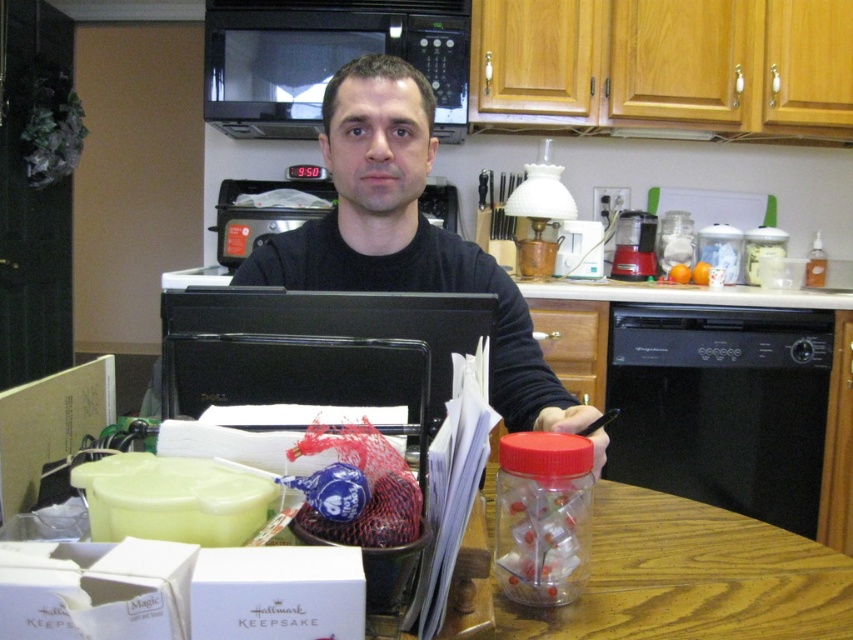
Question: Among these points, which one is nearest to the camera?

Choices:
 (A) (509, 586)
 (B) (817, 602)
 (C) (242, 44)
 (D) (373, 253)

Answer: (A)

Question: Which point appears farthest from the camera in this image?

Choices:
 (A) (566, 477)
 (B) (315, 129)
 (C) (570, 612)
 (D) (422, 161)

Answer: (B)

Question: Is black matte shirt at center in front of wooden table at center?

Choices:
 (A) no
 (B) yes

Answer: (A)

Question: Is black matte shirt at center positioned at the back of translucent plastic jar at center?

Choices:
 (A) no
 (B) yes

Answer: (B)

Question: Which object is positioned closest to the black matte shirt at center?

Choices:
 (A) black matte microwave at upper center
 (B) wooden table at center
 (C) translucent plastic jar at center

Answer: (B)

Question: Is black matte shirt at center positioned behind wooden table at center?

Choices:
 (A) no
 (B) yes

Answer: (B)